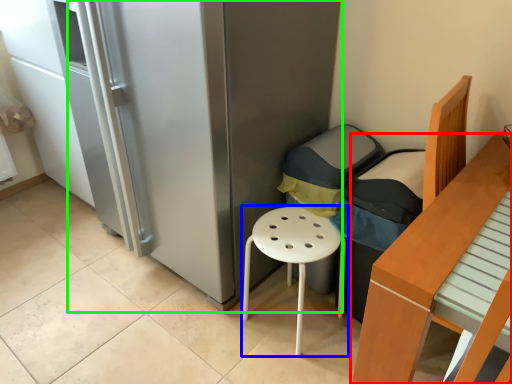
Question: Considering the real-world distances, which object is closest to furniture (highlighted by a red box)? stool (highlighted by a blue box) or fridge (highlighted by a green box).

Choices:
 (A) stool
 (B) fridge

Answer: (A)